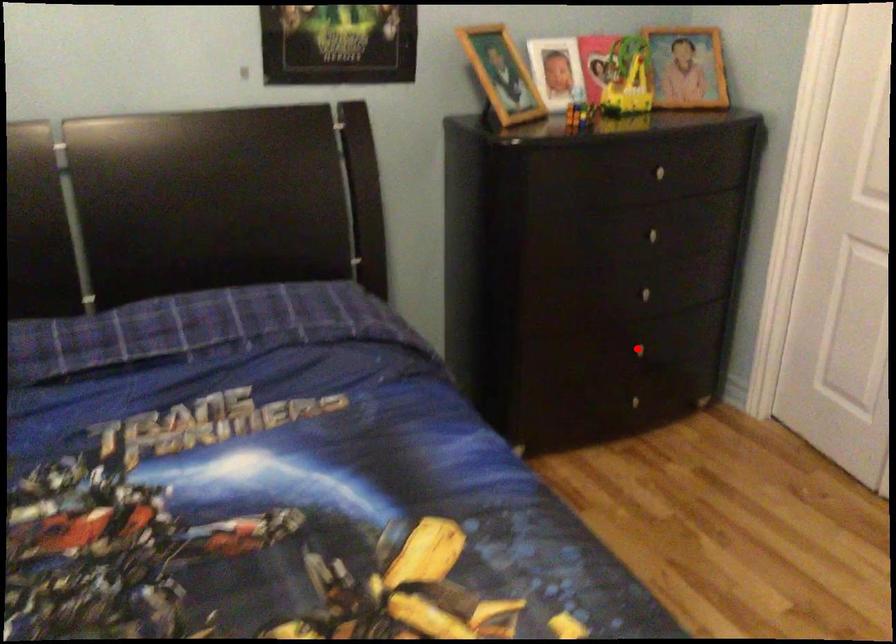
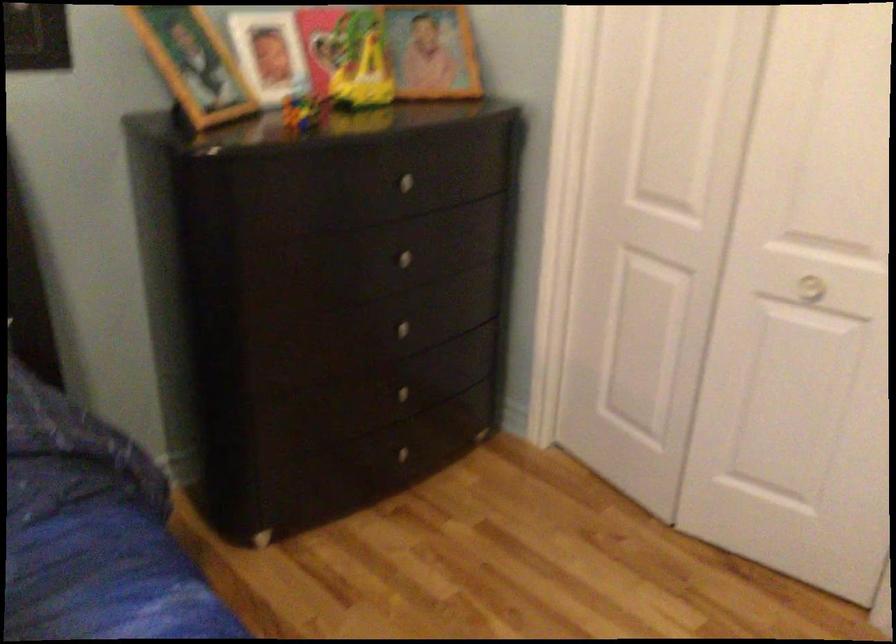
Question: I am providing you with two images of the same scene from different viewpoints. Given a red point in image1, look at the same physical point in image2. Is it:

Choices:
 (A) Closer to the viewpoint
 (B) Farther from the viewpoint

Answer: (A)